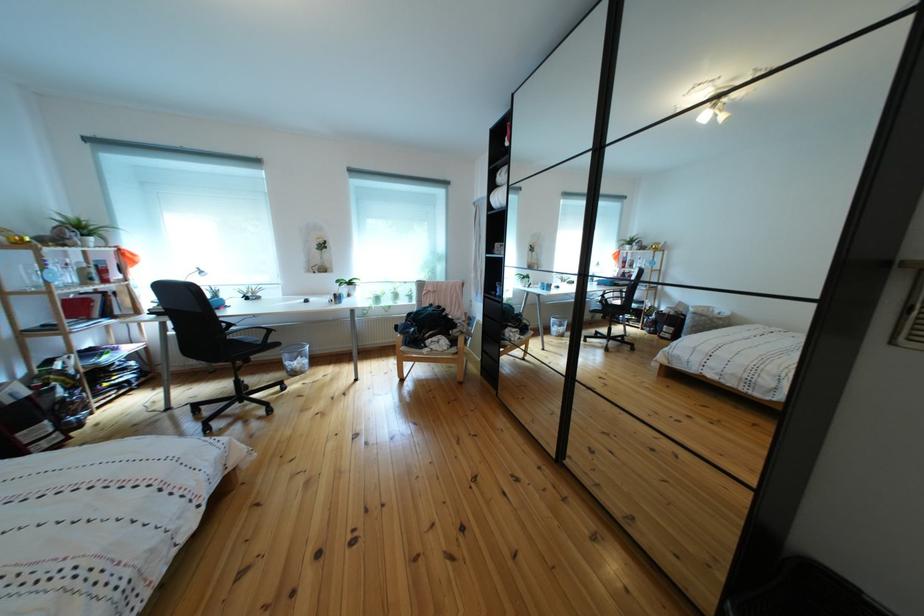
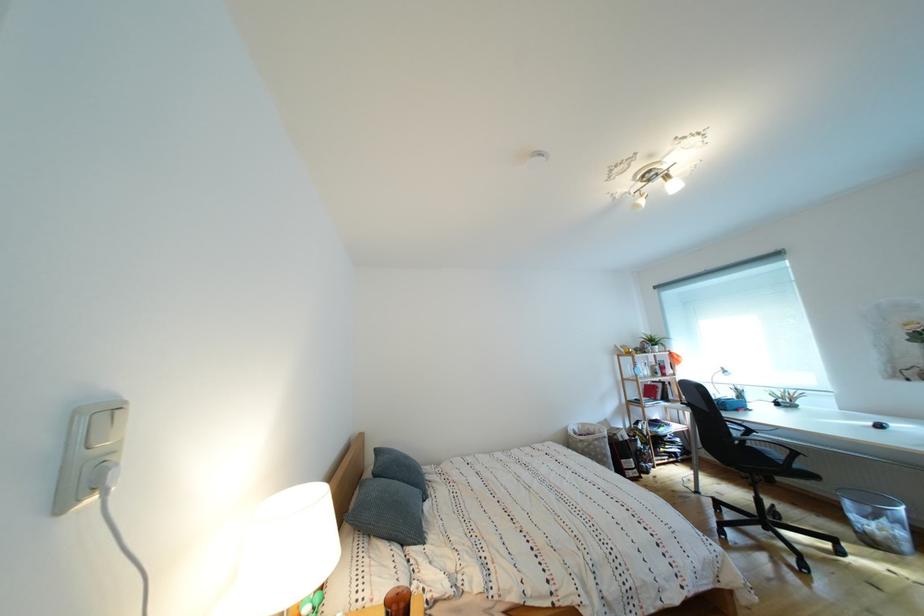
Locate, in the second image, the point that corresponds to [281,346] in the first image.

(808, 472)